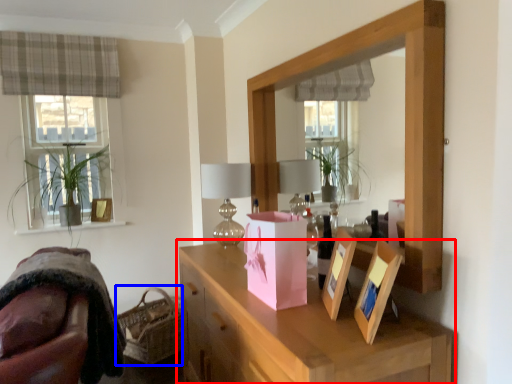
Question: Which object is further to the camera taking this photo, cabinetry (highlighted by a red box) or basket (highlighted by a blue box)?

Choices:
 (A) cabinetry
 (B) basket

Answer: (B)